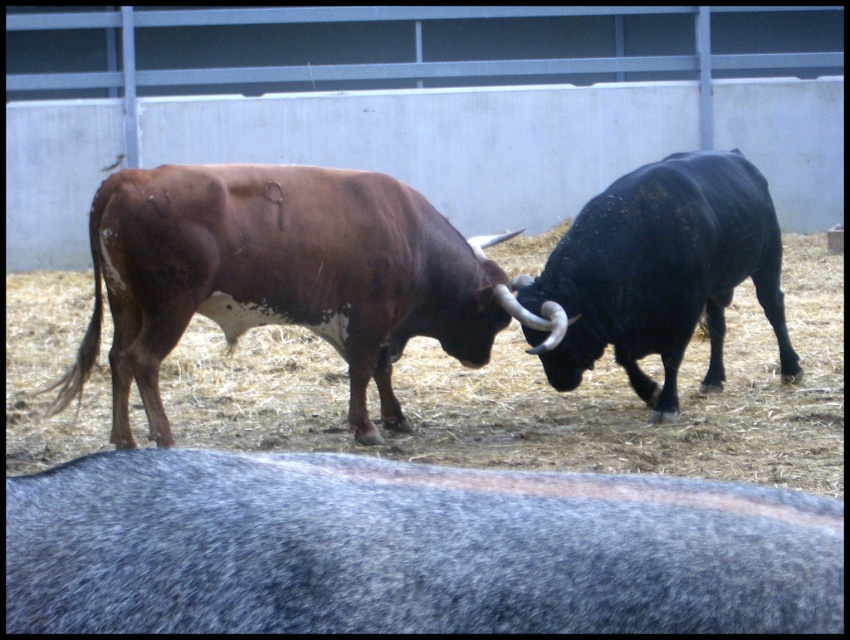
Measure the distance between brown rough hide bull at center and black glossy bull at right.

brown rough hide bull at center and black glossy bull at right are 32.55 inches apart.

Measure the distance between brown rough hide bull at center and camera.

brown rough hide bull at center and camera are 5.25 meters apart from each other.

Is point (386, 269) positioned before point (638, 314)?

Yes, it is in front of point (638, 314).

Locate an element on the screen. brown rough hide bull at center is located at coordinates 285,276.

Does gray woolen yak at lower center have a larger size compared to black glossy bull at right?

No.

Does point (332, 602) lie in front of point (659, 404)?

Yes, it is in front of point (659, 404).

Does point (774, 600) come behind point (579, 372)?

No.

This screenshot has width=850, height=640. I want to click on gray woolen yak at lower center, so click(x=408, y=548).

Who is positioned more to the left, gray woolen yak at lower center or brown rough hide bull at center?

brown rough hide bull at center

Can you confirm if gray woolen yak at lower center is smaller than brown rough hide bull at center?

Indeed, gray woolen yak at lower center has a smaller size compared to brown rough hide bull at center.

Is point (574, 496) closer to camera compared to point (256, 300)?

Yes, point (574, 496) is in front of point (256, 300).

You are a GUI agent. You are given a task and a screenshot of the screen. Output one action in this format:
    pyautogui.click(x=<x>, y=<y>)
    Task: Click on the gray woolen yak at lower center
    
    Given the screenshot: What is the action you would take?
    pyautogui.click(x=408, y=548)